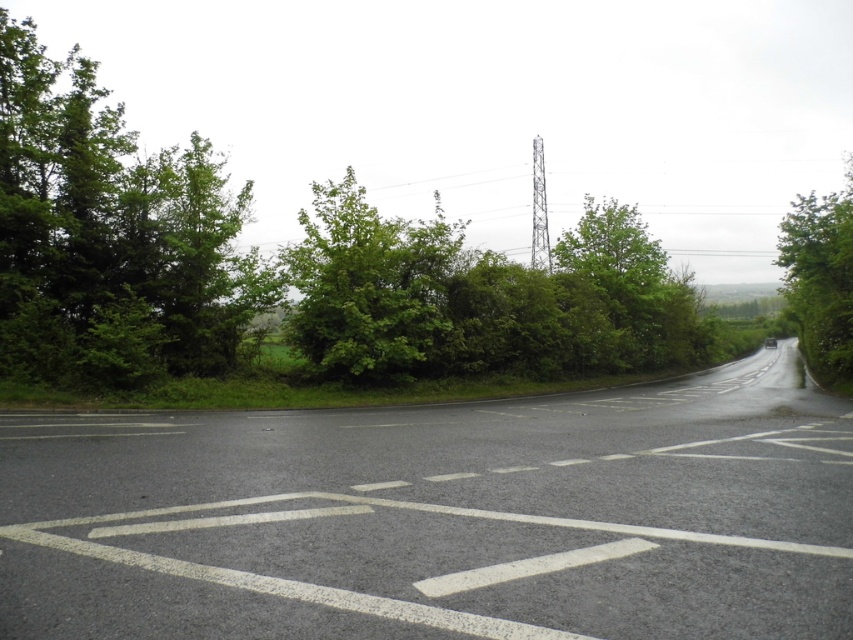
Who is shorter, green leafy tree at left or green leafy bush at center?

green leafy bush at center is shorter.

Find the location of a particular element. This screenshot has width=853, height=640. green leafy tree at left is located at coordinates (111, 236).

Does point (194, 148) come in front of point (103, 147)?

No, (194, 148) is further to viewer.

The width and height of the screenshot is (853, 640). Identify the location of green leafy tree at upper left. (283, 266).

Is green leafy tree at upper left closer to camera compared to green leafy bush at center?

That is True.

Can you confirm if green leafy tree at upper left is wider than green leafy bush at center?

Correct, the width of green leafy tree at upper left exceeds that of green leafy bush at center.

Locate an element on the screen. The height and width of the screenshot is (640, 853). green leafy tree at upper left is located at coordinates (283, 266).

At what (x,y) coordinates should I click in order to perform the action: click on green leafy tree at upper left. Please return your answer as a coordinate pair (x, y). The width and height of the screenshot is (853, 640). Looking at the image, I should click on (283, 266).